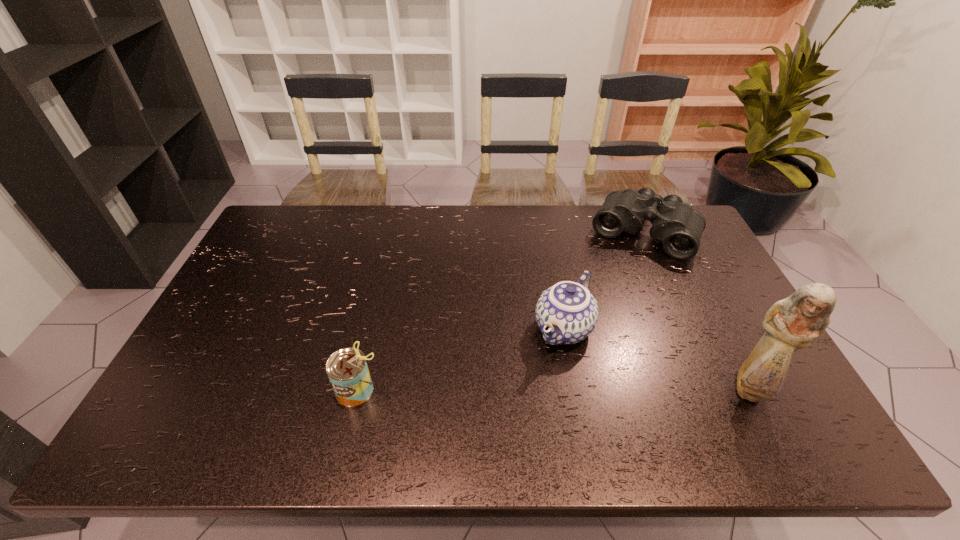
You are a GUI agent. You are given a task and a screenshot of the screen. Output one action in this format:
    pyautogui.click(x=<x>, y=<y>)
    Task: Click on the vacant space situated 0.080m from the spout of the chinaware
    
    Given the screenshot: What is the action you would take?
    pyautogui.click(x=535, y=377)

At what (x,y) coordinates should I click in order to perform the action: click on vacant space located 0.130m from the spout of the chinaware. Please return your answer as a coordinate pair (x, y). The width and height of the screenshot is (960, 540). Looking at the image, I should click on (524, 391).

In order to click on vacant space located from the spout of the chinaware in this screenshot , I will do `click(519, 397)`.

Find the location of a particular element. The width and height of the screenshot is (960, 540). object positioned at the far edge is located at coordinates (674, 223).

Image resolution: width=960 pixels, height=540 pixels. Find the location of `can that is positioned at the near edge`. can that is positioned at the near edge is located at coordinates (347, 369).

Find the location of a particular element. The height and width of the screenshot is (540, 960). figurine present at the near edge is located at coordinates (793, 323).

Image resolution: width=960 pixels, height=540 pixels. Identify the location of figurine located in the right edge section of the desktop. (793, 323).

Locate an element on the screen. binoculars positioned at the right edge is located at coordinates (674, 223).

Where is `object present at the far right corner`? Image resolution: width=960 pixels, height=540 pixels. object present at the far right corner is located at coordinates (674, 223).

Where is `object positioned at the near right corner`? object positioned at the near right corner is located at coordinates (793, 323).